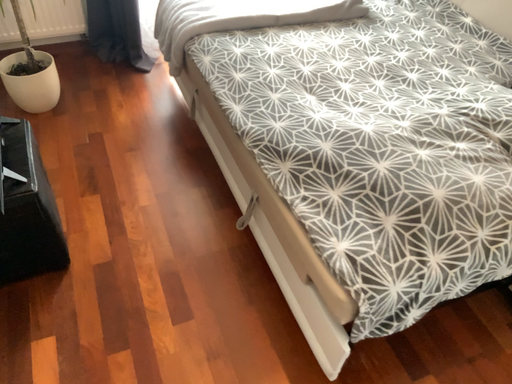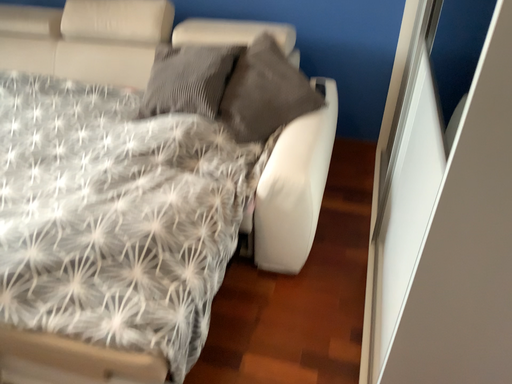
Question: Which way did the camera rotate in the video?

Choices:
 (A) rotated upward
 (B) rotated downward

Answer: (A)